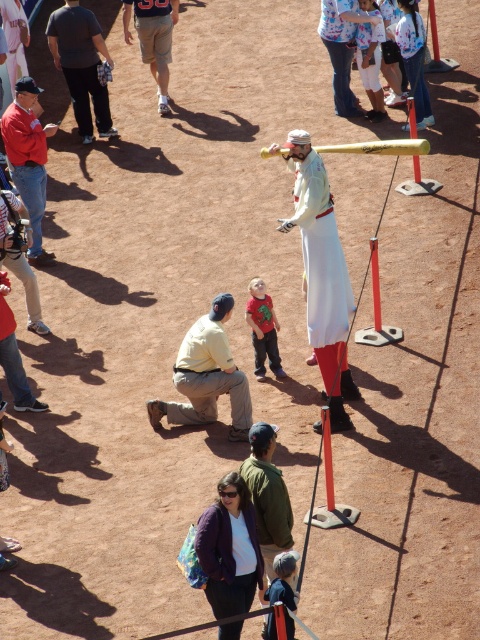
Question: Which object is closer to the camera taking this photo?

Choices:
 (A) smooth wooden bat at center
 (B) red cotton shirt at center

Answer: (A)

Question: Which is farther from the matte red jacket at left?

Choices:
 (A) light yellow shirt at center
 (B) dark gray cotton shirt at upper left
 (C) red cotton shirt at center
 (D) smooth orange pole at center

Answer: (A)

Question: Is dark gray cotton shirt at upper left smaller than matte red jacket at left?

Choices:
 (A) yes
 (B) no

Answer: (B)

Question: Does red cotton shirt at center have a lesser width compared to smooth orange pole at center?

Choices:
 (A) no
 (B) yes

Answer: (A)

Question: Which object is farther from the camera taking this photo?

Choices:
 (A) smooth orange pole at center
 (B) smooth wooden bat at center

Answer: (A)

Question: From the image, what is the correct spatial relationship of red cotton shirt at center in relation to smooth yellow bat at center?

Choices:
 (A) left
 (B) right

Answer: (A)